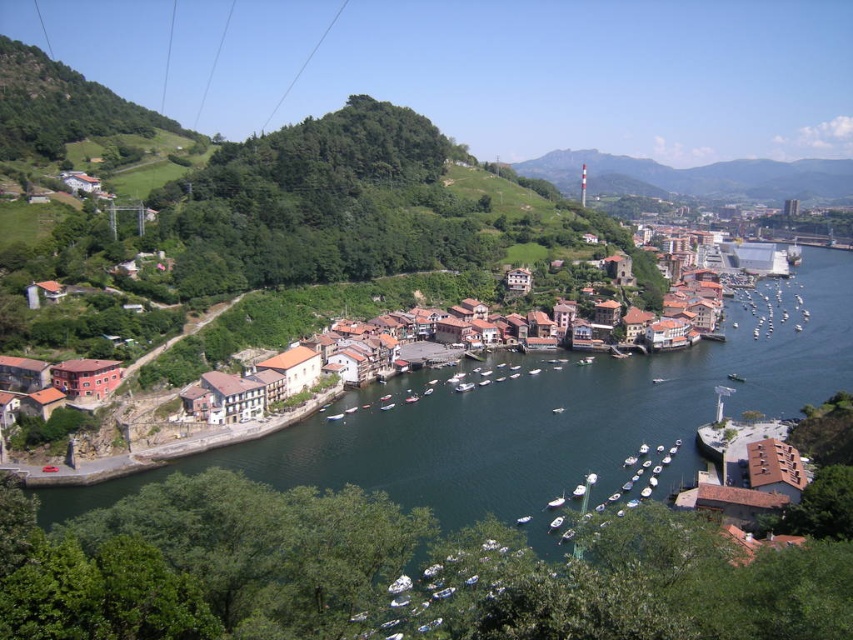
Question: Which point appears closest to the camera in this image?

Choices:
 (A) (762, 362)
 (B) (650, 168)

Answer: (A)

Question: Which object appears closest to the camera in this image?

Choices:
 (A) green grassy hillside at upper center
 (B) brown wooden houses at center

Answer: (B)

Question: Can you confirm if dark blue water at center is positioned to the right of brown wooden houses at center?

Choices:
 (A) no
 (B) yes

Answer: (A)

Question: Does dark blue water at center have a larger size compared to green grassy hillside at upper center?

Choices:
 (A) yes
 (B) no

Answer: (A)

Question: Which point is farther to the camera?

Choices:
 (A) (711, 195)
 (B) (576, 422)
 (C) (370, 285)

Answer: (A)

Question: Is dark blue water at center thinner than brown wooden houses at center?

Choices:
 (A) yes
 (B) no

Answer: (A)